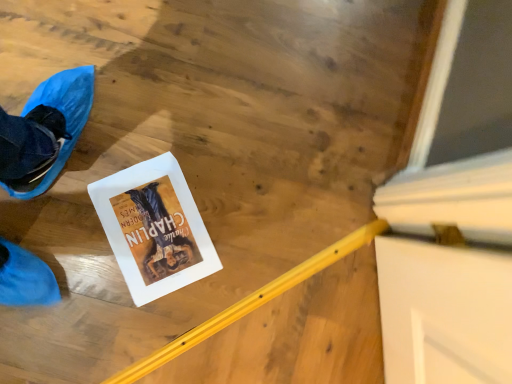
Find the location of `free point below white paper book cover at center (from a real-world perspective)`. free point below white paper book cover at center (from a real-world perspective) is located at coordinates (154, 228).